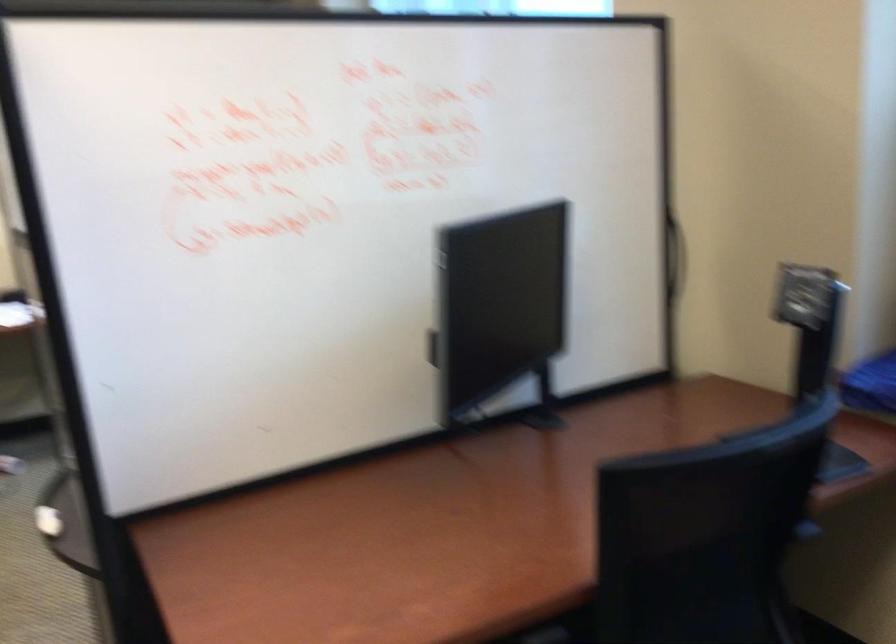
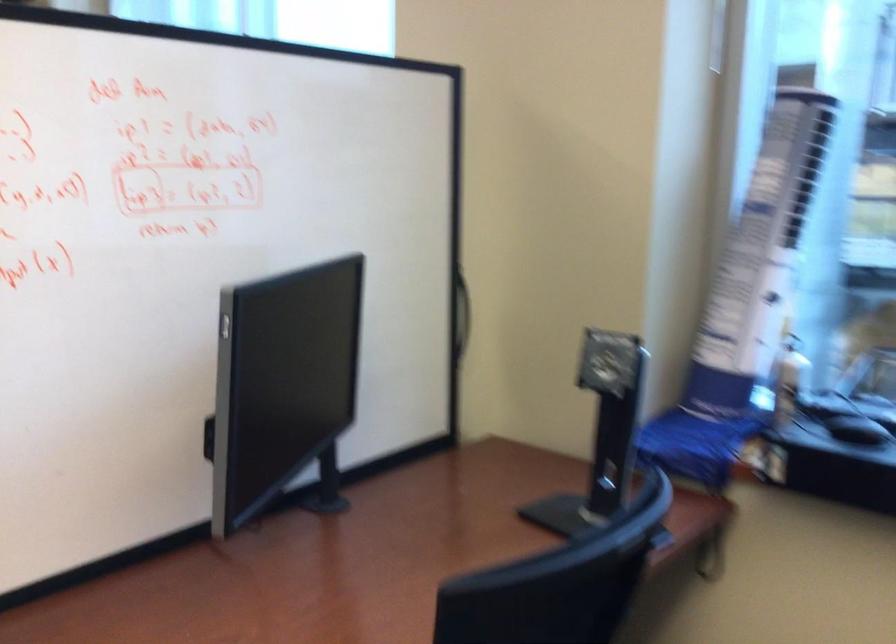
Question: Based on the continuous images, in which direction is the camera rotating? Reply with the corresponding letter.

Choices:
 (A) Left
 (B) Right
 (C) Up
 (D) Down

Answer: (B)